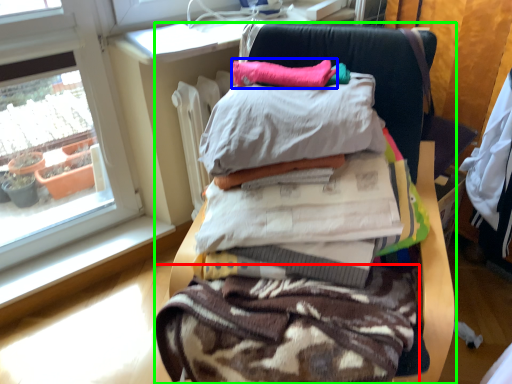
Question: Which object is positioned closest to fabric (highlighted by a red box)? Select from pillow (highlighted by a blue box) and furniture (highlighted by a green box).

Choices:
 (A) pillow
 (B) furniture

Answer: (B)